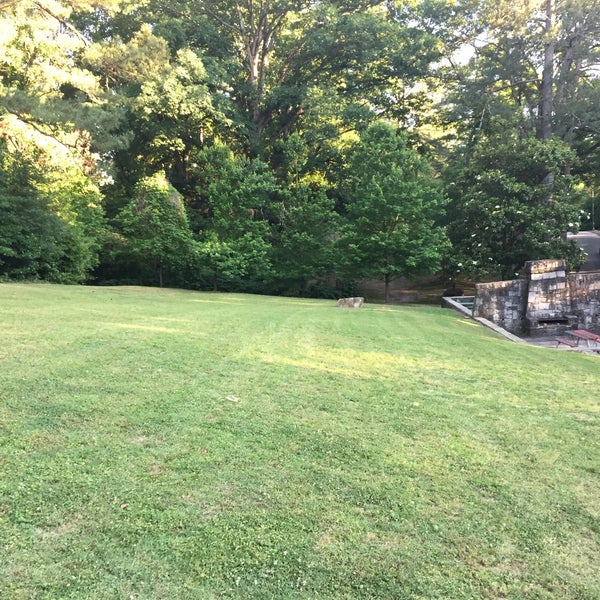
Find the location of a particular element. The height and width of the screenshot is (600, 600). bench is located at coordinates (585, 336).